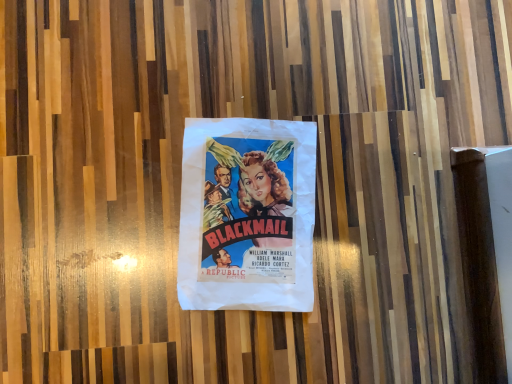
Describe the element at coordinates (247, 215) in the screenshot. I see `matte paper poster at center` at that location.

At what (x,y) coordinates should I click in order to perform the action: click on matte paper poster at center. Please return your answer as a coordinate pair (x, y). The height and width of the screenshot is (384, 512). Looking at the image, I should click on (247, 215).

Locate an element on the screen. matte paper poster at center is located at coordinates (247, 215).